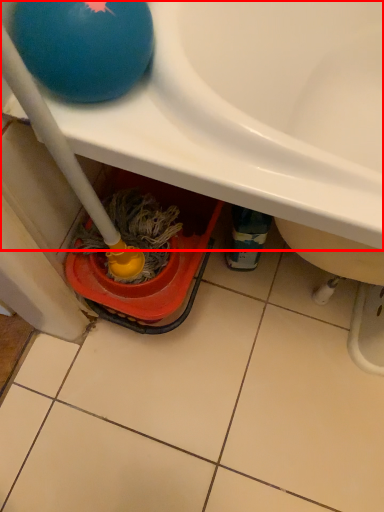
Question: From the image's perspective, what is the correct spatial positioning of sink (annotated by the red box) in reference to ball?

Choices:
 (A) above
 (B) below

Answer: (A)